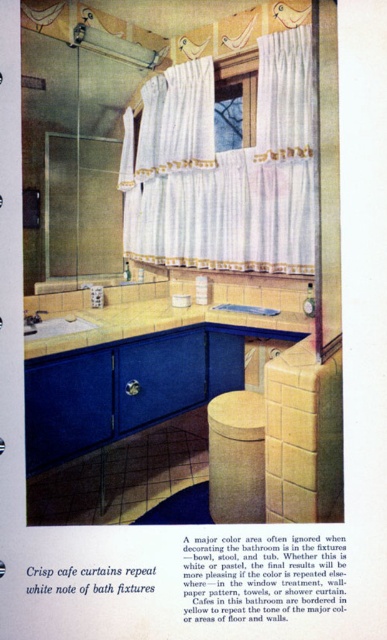
Question: Does matte white sink at lower left have a lesser width compared to brushed metal faucet at lower left?

Choices:
 (A) no
 (B) yes

Answer: (A)

Question: Is white sheer curtain at upper center further to camera compared to brushed metal faucet at lower left?

Choices:
 (A) yes
 (B) no

Answer: (A)

Question: Which point is farther to the camera?

Choices:
 (A) white sheer curtain at upper center
 (B) wooden textured stool at center
 (C) matte white sink at lower left

Answer: (A)

Question: Among these objects, which one is farthest from the camera?

Choices:
 (A) wooden textured stool at center
 (B) matte white sink at lower left
 (C) white sheer curtain at upper center

Answer: (C)

Question: Observing the image, what is the correct spatial positioning of wooden textured stool at center in reference to matte white sink at lower left?

Choices:
 (A) right
 (B) left

Answer: (A)

Question: Which object is closer to the camera taking this photo?

Choices:
 (A) wooden textured stool at center
 (B) brushed metal faucet at lower left
 (C) white sheer curtain at upper center
 (D) matte white sink at lower left

Answer: (A)